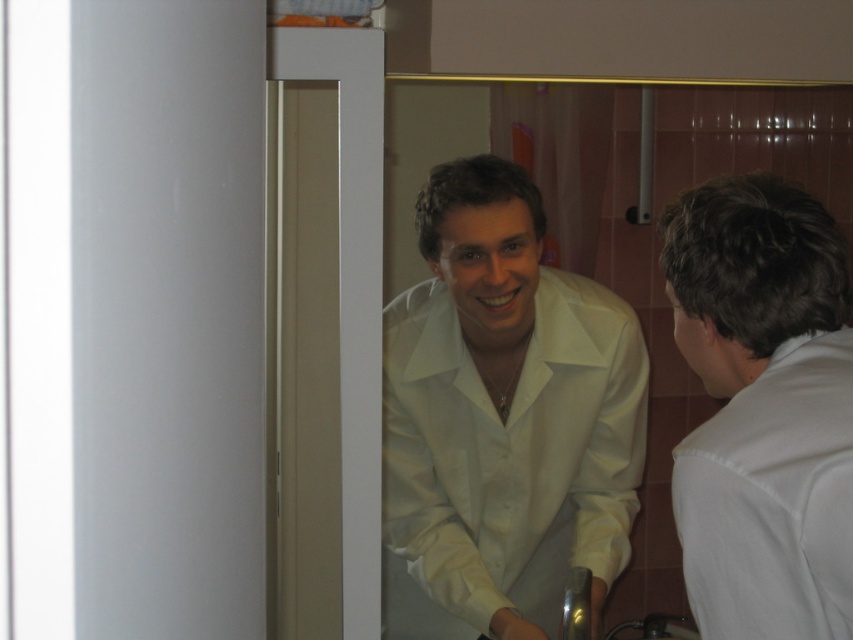
Question: Which point is closer to the camera taking this photo?

Choices:
 (A) (762, 237)
 (B) (496, 406)

Answer: (A)

Question: Is white glossy shirt at center wider than white matte shirt at right?

Choices:
 (A) yes
 (B) no

Answer: (A)

Question: Among these points, which one is nearest to the camera?

Choices:
 (A) (691, 556)
 (B) (492, 328)

Answer: (A)

Question: Can you confirm if white glossy shirt at center is positioned to the right of white matte shirt at right?

Choices:
 (A) yes
 (B) no

Answer: (B)

Question: Does white glossy shirt at center appear under white matte shirt at right?

Choices:
 (A) no
 (B) yes

Answer: (B)

Question: Among these points, which one is farthest from the camera?

Choices:
 (A) (785, 243)
 (B) (555, 541)

Answer: (B)